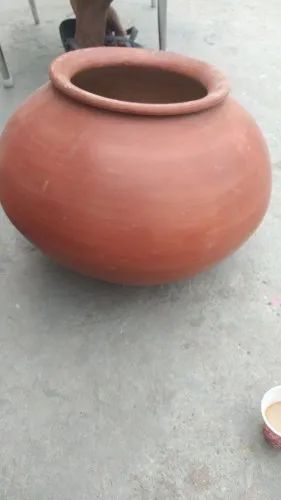
What are the coordinates of `clay planter` in the screenshot? It's located at (185, 231).